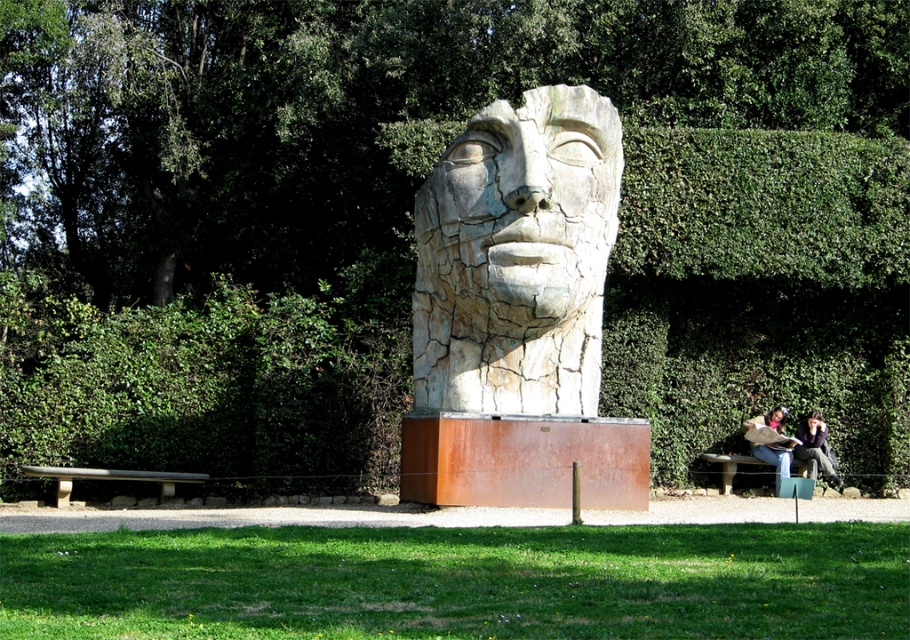
You are a park visitor who wants to sit on the matte brown bench at lower right. Can you determine if the cracked stone head at center is wider than the bench?

The cracked stone head at center is wider than the matte brown bench at lower right, so yes, the cracked stone head at center is wider than the bench.

You are an artist planning to paint a mural inspired by this scene. You want to ensure the cracked stone head at center and smooth pink face at center are both visible in your painting. Given their sizes, which object should you make larger to maintain accuracy?

The cracked stone head at center is larger in size than smooth pink face at center, so you should make the cracked stone head at center larger in your painting to maintain accuracy.